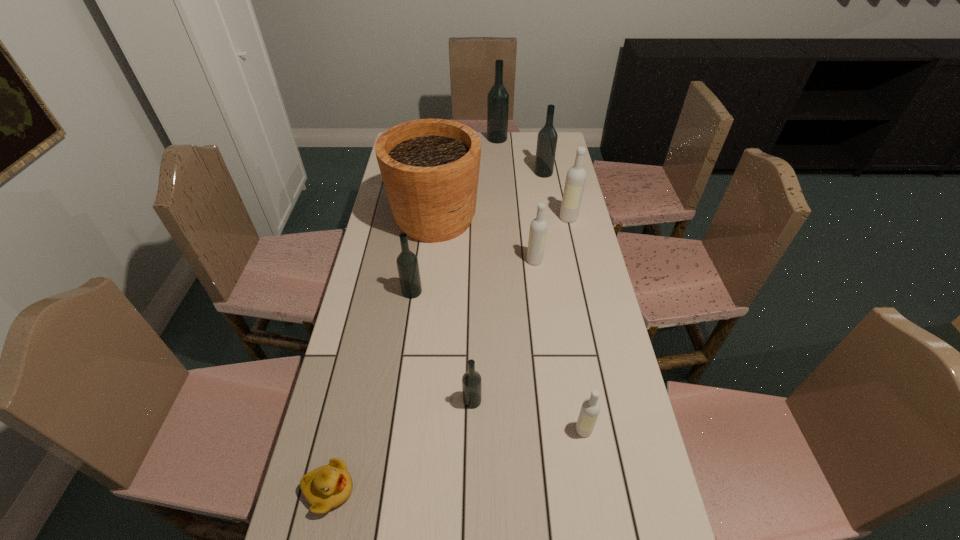
Identify the location of free space that satisfies the following two spatial constraints: 1. on the front side of the second farthest object; 2. on the left side of the farthest black vodka. The width and height of the screenshot is (960, 540). (499, 173).

The width and height of the screenshot is (960, 540). I want to click on vacant space that satisfies the following two spatial constraints: 1. on the front side of the sixth object from left to right; 2. on the left side of the flowerpot, so click(430, 261).

This screenshot has height=540, width=960. What are the coordinates of `vacant space that satisfies the following two spatial constraints: 1. on the back side of the farthest white vodka; 2. on the left side of the fifth farthest object` in the screenshot? It's located at (529, 218).

Locate an element on the screen. vacant point that satisfies the following two spatial constraints: 1. on the back side of the third biggest black vodka; 2. on the right side of the rightmost white vodka is located at coordinates point(422,218).

Image resolution: width=960 pixels, height=540 pixels. Identify the location of free location that satisfies the following two spatial constraints: 1. on the back side of the flowerpot; 2. on the left side of the leftmost black vodka. (422, 219).

This screenshot has width=960, height=540. I want to click on vacant region that satisfies the following two spatial constraints: 1. on the front side of the second nearest white vodka; 2. on the front-facing side of the shortest object, so click(563, 490).